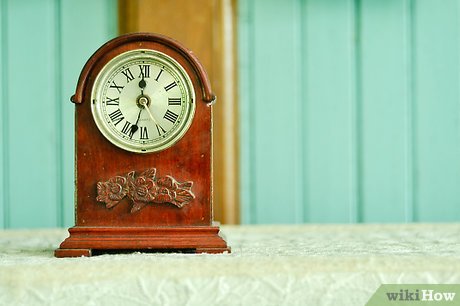
Where is `old wooden clock`? old wooden clock is located at coordinates (201, 166).